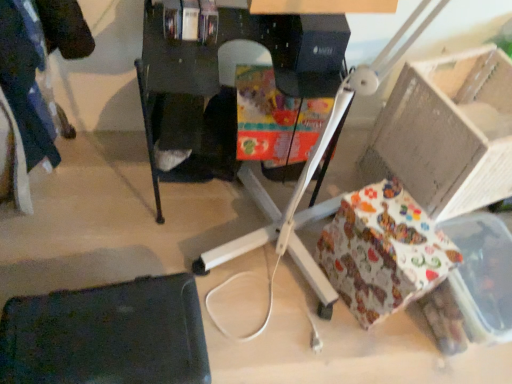
Question: From a real-world perspective, is black plastic desk at center located beneath patterned paper gift at lower right?

Choices:
 (A) yes
 (B) no

Answer: (B)

Question: Is black plastic desk at center behind patterned paper gift at lower right?

Choices:
 (A) no
 (B) yes

Answer: (A)

Question: Considering the relative sizes of black plastic desk at center and patterned paper gift at lower right in the image provided, is black plastic desk at center shorter than patterned paper gift at lower right?

Choices:
 (A) yes
 (B) no

Answer: (B)

Question: Would you say black plastic desk at center is outside patterned paper gift at lower right?

Choices:
 (A) no
 (B) yes

Answer: (B)

Question: Can you confirm if black plastic desk at center is smaller than patterned paper gift at lower right?

Choices:
 (A) yes
 (B) no

Answer: (B)

Question: From the image's perspective, is patterned paper gift at lower right above or below black plastic desk at center?

Choices:
 (A) above
 (B) below

Answer: (B)

Question: Do you think patterned paper gift at lower right is within black plastic desk at center, or outside of it?

Choices:
 (A) inside
 (B) outside

Answer: (B)

Question: Considering the positions of patterned paper gift at lower right and black plastic desk at center in the image, is patterned paper gift at lower right taller or shorter than black plastic desk at center?

Choices:
 (A) tall
 (B) short

Answer: (B)

Question: Is patterned paper gift at lower right to the left or to the right of black plastic desk at center in the image?

Choices:
 (A) right
 (B) left

Answer: (A)

Question: From the image's perspective, relative to black matte swivel chair at lower left, is black plastic desk at center above or below?

Choices:
 (A) below
 (B) above

Answer: (B)

Question: Is black plastic desk at center in front of or behind black matte swivel chair at lower left in the image?

Choices:
 (A) behind
 (B) front

Answer: (A)

Question: Is point (157, 92) positioned closer to the camera than point (106, 286)?

Choices:
 (A) closer
 (B) farther

Answer: (A)

Question: In terms of width, does black plastic desk at center look wider or thinner when compared to black matte swivel chair at lower left?

Choices:
 (A) wide
 (B) thin

Answer: (A)

Question: From the image's perspective, is black plastic desk at center above or below patterned paper gift at lower right?

Choices:
 (A) above
 (B) below

Answer: (A)

Question: Based on their sizes in the image, would you say black plastic desk at center is bigger or smaller than patterned paper gift at lower right?

Choices:
 (A) small
 (B) big

Answer: (B)